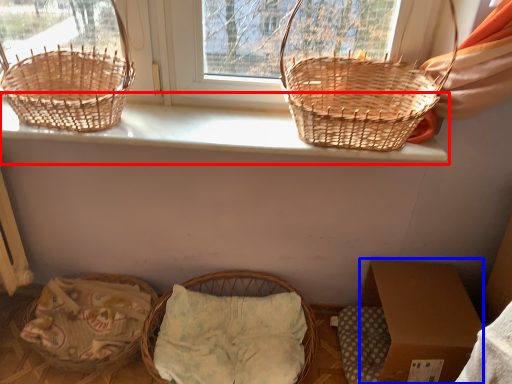
Question: Which object appears closest to the camera in this image, window sill (highlighted by a red box) or cardboard box (highlighted by a blue box)?

Choices:
 (A) window sill
 (B) cardboard box

Answer: (A)